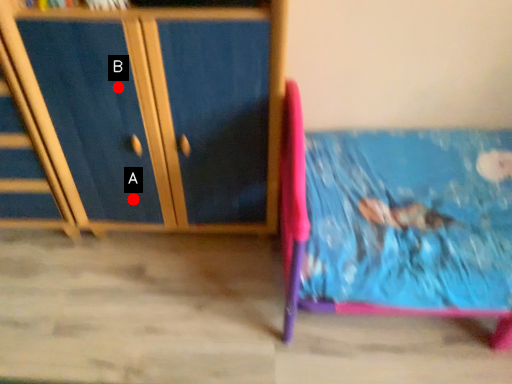
Question: Two points are circled on the image, labeled by A and B beside each circle. Among these points, which one is nearest to the camera?

Choices:
 (A) A is closer
 (B) B is closer

Answer: (B)